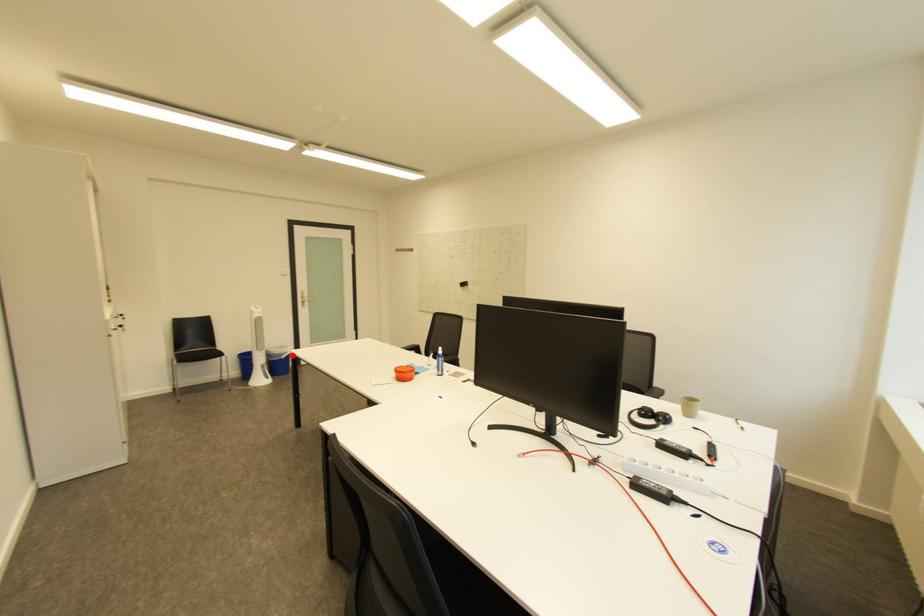
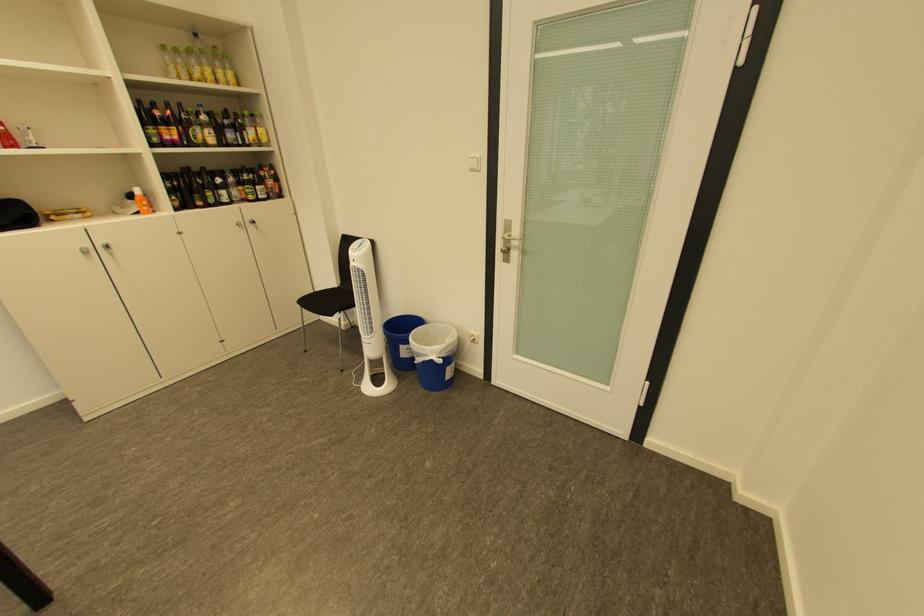
Find the pixel in the second image that matches the highlighted location in the first image.

(429, 355)